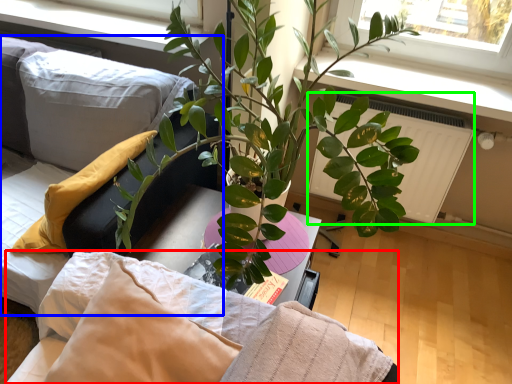
Question: Which object is the closest to the bedding (highlighted by a red box)? Choose among these: couch (highlighted by a blue box) or radiator (highlighted by a green box).

Choices:
 (A) couch
 (B) radiator

Answer: (A)